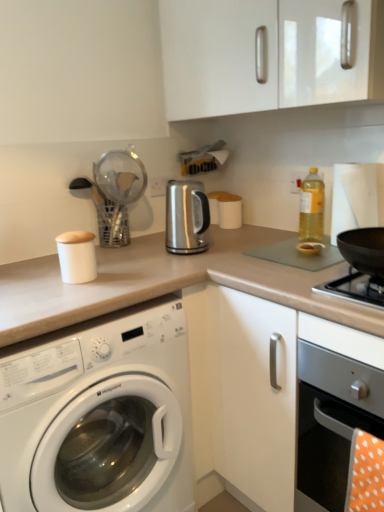
Question: Is white glossy washing machine at lower left thinner than satin metallic kettle at center, which is counted as the first appliance, starting from the right?

Choices:
 (A) yes
 (B) no

Answer: (B)

Question: Can you confirm if white glossy washing machine at lower left is positioned to the left of satin metallic kettle at center, acting as the 1th appliance starting from the back?

Choices:
 (A) no
 (B) yes

Answer: (B)

Question: Is white glossy washing machine at lower left not inside satin metallic kettle at center, acting as the second appliance starting from the front?

Choices:
 (A) no
 (B) yes

Answer: (B)

Question: From the image's perspective, is white glossy washing machine at lower left located beneath satin metallic kettle at center, acting as the 1th appliance starting from the back?

Choices:
 (A) yes
 (B) no

Answer: (A)

Question: Can you confirm if white glossy washing machine at lower left is smaller than satin metallic kettle at center, which is counted as the first appliance, starting from the right?

Choices:
 (A) no
 (B) yes

Answer: (A)

Question: Considering the relative positions of white glossy washing machine at lower left and satin metallic kettle at center, acting as the 1th appliance starting from the back, in the image provided, is white glossy washing machine at lower left behind satin metallic kettle at center, acting as the 1th appliance starting from the back,?

Choices:
 (A) no
 (B) yes

Answer: (A)

Question: From a real-world perspective, is satin metallic kettle at center, acting as the second appliance starting from the front, physically below white glossy washing machine at lower left?

Choices:
 (A) no
 (B) yes

Answer: (A)

Question: Considering the relative sizes of satin metallic kettle at center, acting as the 1th appliance starting from the back, and white glossy washing machine at lower left in the image provided, is satin metallic kettle at center, acting as the 1th appliance starting from the back, shorter than white glossy washing machine at lower left?

Choices:
 (A) no
 (B) yes

Answer: (B)

Question: Can you confirm if satin metallic kettle at center, which is the second appliance from left to right, is thinner than white glossy washing machine at lower left?

Choices:
 (A) yes
 (B) no

Answer: (A)

Question: Does satin metallic kettle at center, acting as the second appliance starting from the front, turn towards white glossy washing machine at lower left?

Choices:
 (A) no
 (B) yes

Answer: (A)

Question: From a real-world perspective, does satin metallic kettle at center, acting as the second appliance starting from the front, stand above white glossy washing machine at lower left?

Choices:
 (A) yes
 (B) no

Answer: (A)

Question: From the image's perspective, is satin metallic kettle at center, acting as the second appliance starting from the front, on top of white glossy washing machine at lower left?

Choices:
 (A) no
 (B) yes

Answer: (B)

Question: Does black matte wok at right have a greater height compared to satin silver oven at lower right?

Choices:
 (A) yes
 (B) no

Answer: (B)